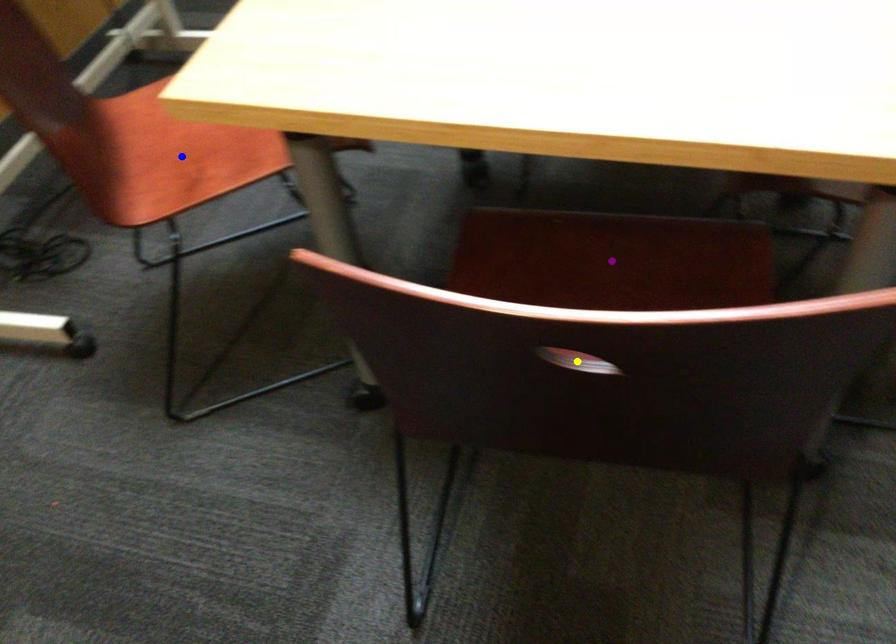
Order these from farthest to nearest:
1. yellow point
2. purple point
3. blue point

blue point → purple point → yellow point